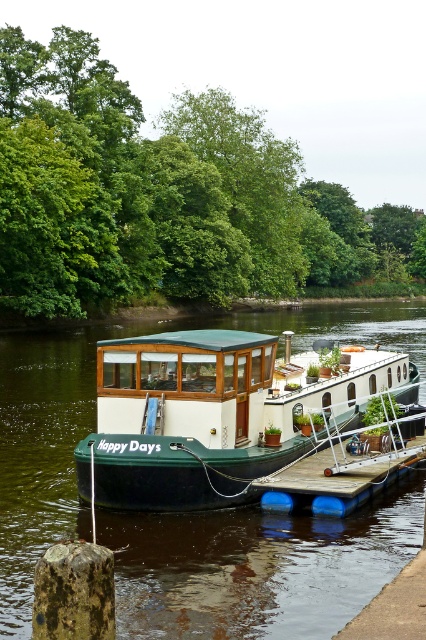
Between green matte houseboat at center and wooden at center, which one appears on the right side from the viewer's perspective?

From the viewer's perspective, wooden at center appears more on the right side.

Is the position of green matte houseboat at center less distant than that of wooden at center?

No, green matte houseboat at center is further to the viewer.

Measure the distance between green matte houseboat at center and camera.

green matte houseboat at center is 12.43 meters from camera.

The height and width of the screenshot is (640, 426). In order to click on green matte houseboat at center in this screenshot , I will do `click(221, 413)`.

Does green matte boat at center appear on the left side of green matte houseboat at center?

Yes, green matte boat at center is to the left of green matte houseboat at center.

Measure the distance between green matte boat at center and camera.

A distance of 8.71 meters exists between green matte boat at center and camera.

Which is behind, point (192, 321) or point (316, 401)?

Point (192, 321)

At what (x,y) coordinates should I click in order to perform the action: click on green matte boat at center. Please return your answer as a coordinate pair (x, y). Looking at the image, I should click on (256, 566).

Who is taller, green matte boat at center or wooden at center?

green matte boat at center

What are the coordinates of `green matte boat at center` in the screenshot? It's located at (256, 566).